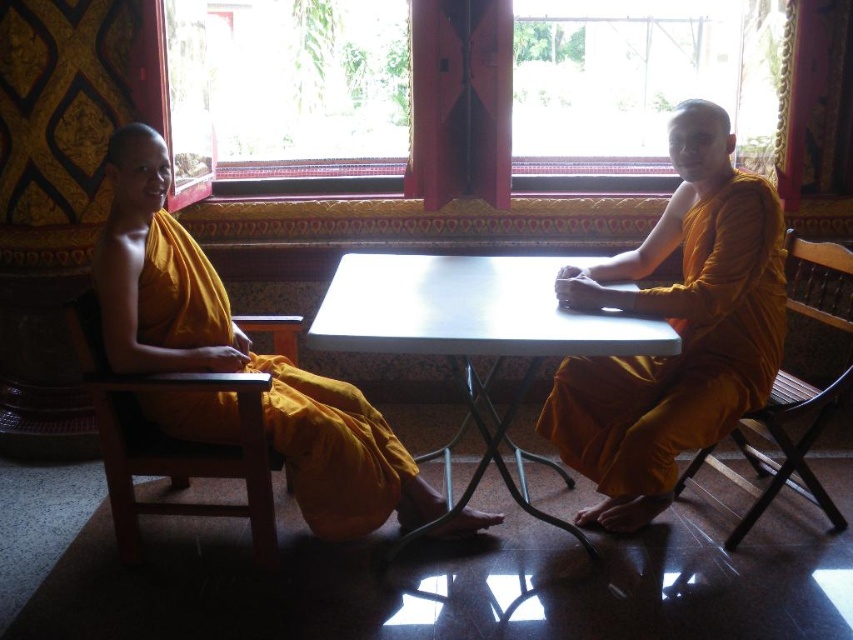
Question: Which is farther from the wooden chair at left?

Choices:
 (A) matte yellow robe at center
 (B) matte yellow robe at left
 (C) white plastic table at center
 (D) wooden chair at right

Answer: (D)

Question: Is white plastic table at center to the right of matte yellow robe at left from the viewer's perspective?

Choices:
 (A) yes
 (B) no

Answer: (A)

Question: Which object is the closest to the matte yellow robe at left?

Choices:
 (A) matte yellow robe at center
 (B) wooden chair at left
 (C) white plastic table at center
 (D) wooden chair at right

Answer: (B)

Question: Considering the real-world distances, which object is farthest from the matte yellow robe at left?

Choices:
 (A) wooden chair at right
 (B) white plastic table at center
 (C) matte yellow robe at center

Answer: (A)

Question: Does matte yellow robe at center lie in front of white plastic table at center?

Choices:
 (A) yes
 (B) no

Answer: (B)

Question: From the image, what is the correct spatial relationship of matte yellow robe at center in relation to wooden chair at right?

Choices:
 (A) left
 (B) right

Answer: (A)